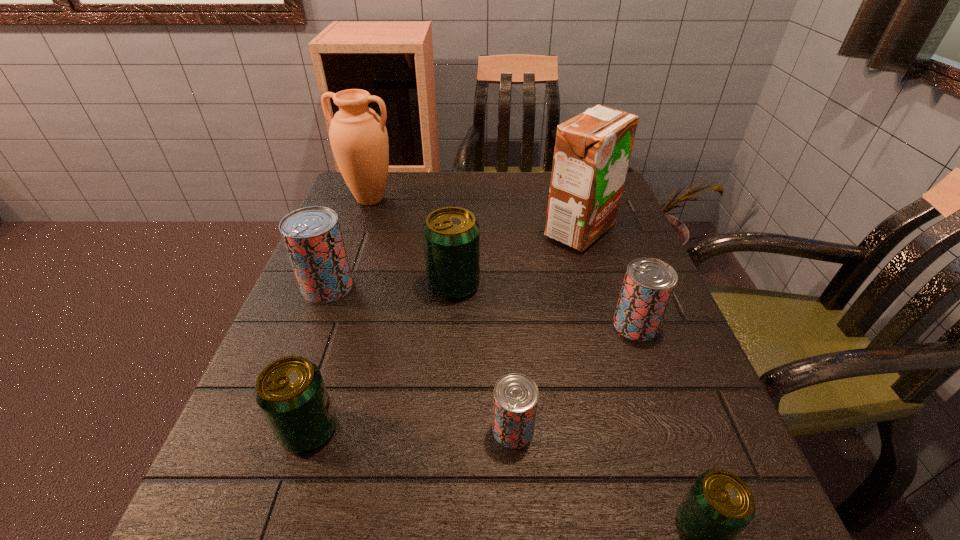
Image resolution: width=960 pixels, height=540 pixels. In the image, there is a desktop. What are the coordinates of `vacant space at the right edge` in the screenshot? It's located at (688, 450).

I want to click on vacant space at the far left corner, so click(x=396, y=190).

In the image, there is a desktop. Where is `vacant space at the near right corner`? The width and height of the screenshot is (960, 540). vacant space at the near right corner is located at coordinates (685, 494).

Where is `empty space between the biggest green beer can and the second farthest red beer can`? empty space between the biggest green beer can and the second farthest red beer can is located at coordinates (544, 305).

Identify the location of empty space between the second nearest green beer can and the third beer can from right to left. (411, 430).

This screenshot has height=540, width=960. I want to click on free space between the carton and the second green beer can from right to left, so click(516, 258).

Locate an element on the screen. The width and height of the screenshot is (960, 540). free area in between the carton and the urn is located at coordinates (475, 215).

This screenshot has height=540, width=960. Identify the location of empty space that is in between the second nearest green beer can and the farthest green beer can. (381, 357).

The image size is (960, 540). I want to click on vacant region between the smallest red beer can and the biggest green beer can, so click(x=484, y=357).

Identify which object is located as the second nearest to the second nearest green beer can. Please provide its 2D coordinates. Your answer should be formatted as a tuple, i.e. [(x, y)], where the tuple contains the x and y coordinates of a point satisfying the conditions above.

[(515, 400)]